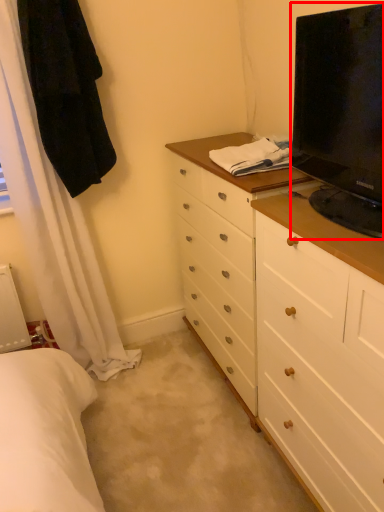
Question: From the image's perspective, where is television (annotated by the red box) located in relation to robe in the image?

Choices:
 (A) below
 (B) above

Answer: (A)